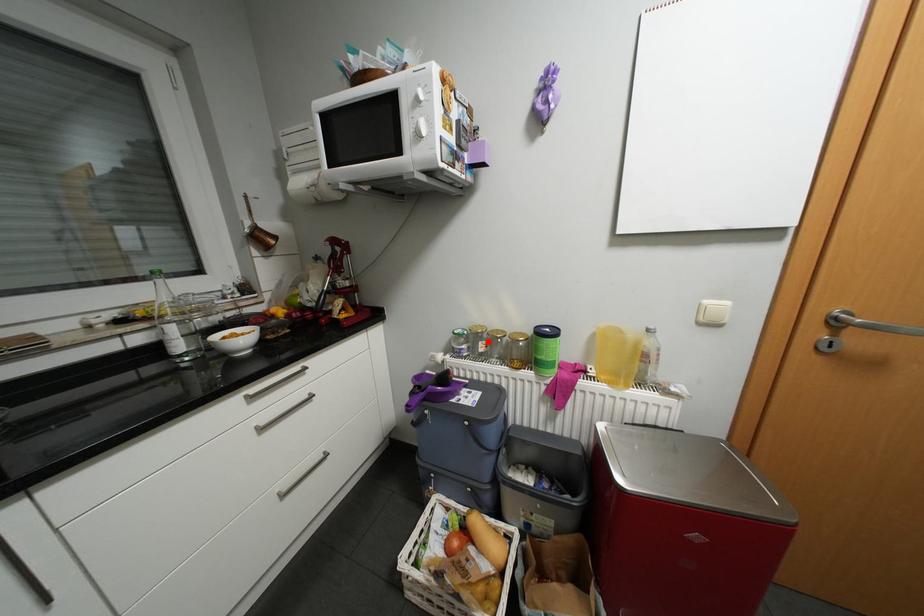
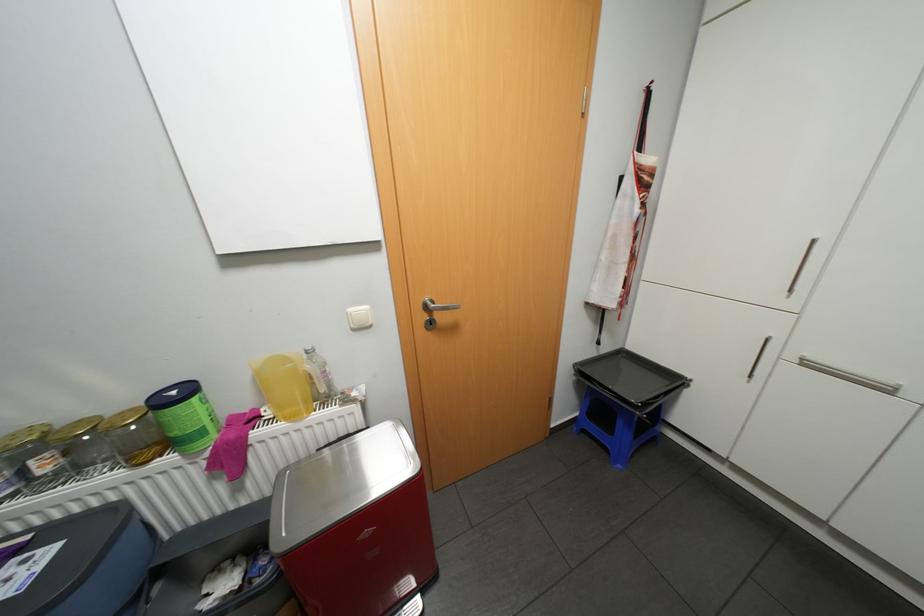
Where in the second image is the point corresponding to the highlighted location from the first image?

(39, 461)